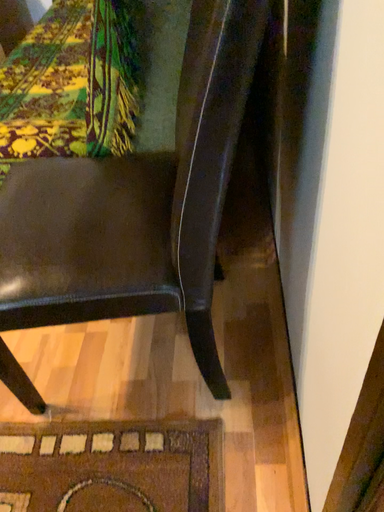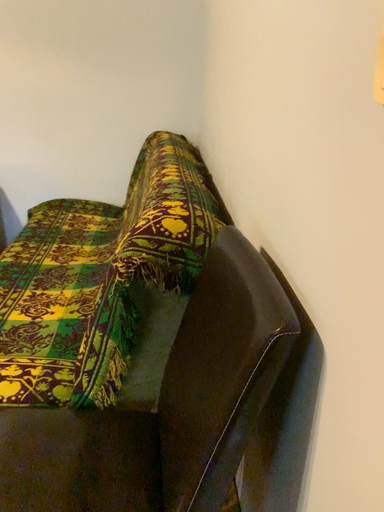
Question: Which way did the camera rotate in the video?

Choices:
 (A) rotated left
 (B) rotated right

Answer: (B)